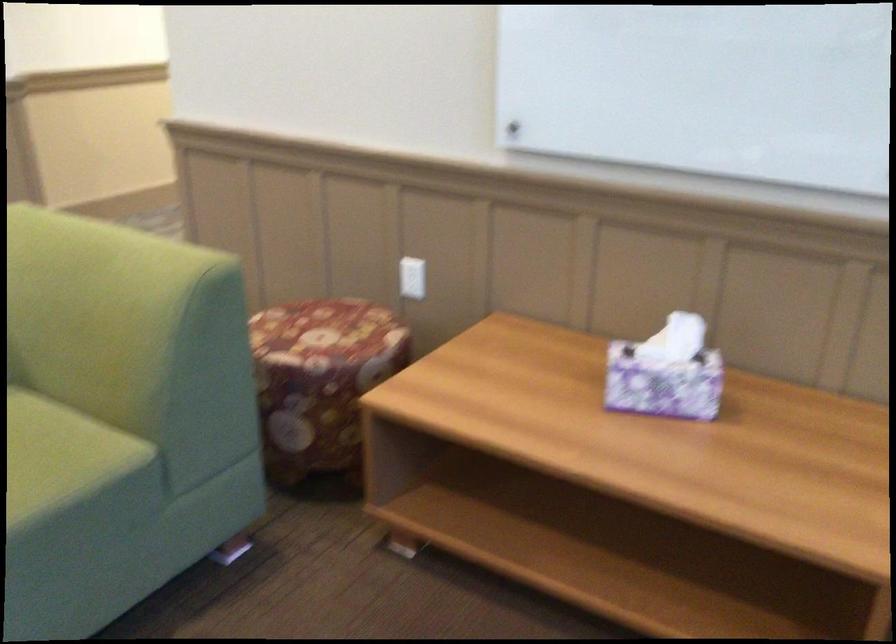
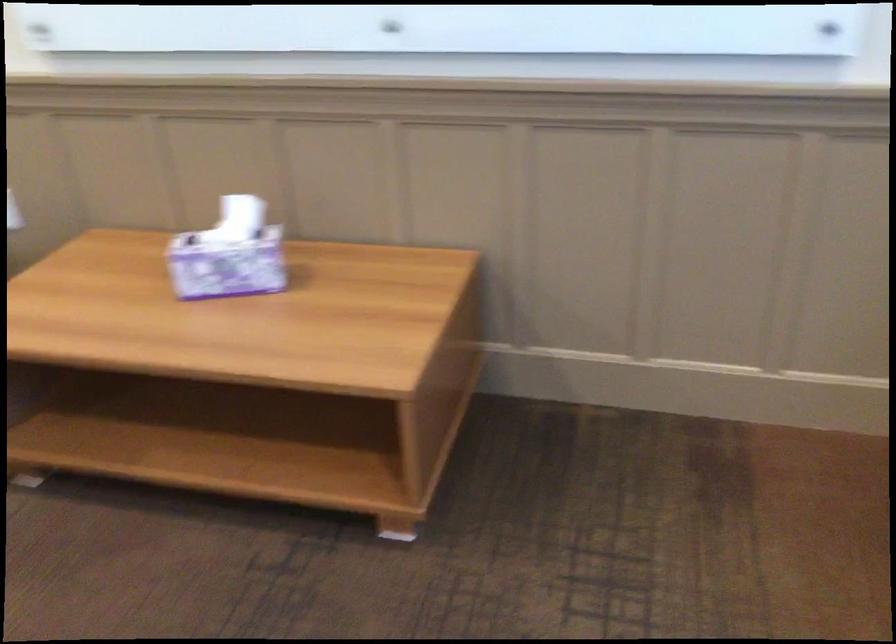
Locate, in the second image, the point that corresponds to (685,332) in the first image.

(239, 218)